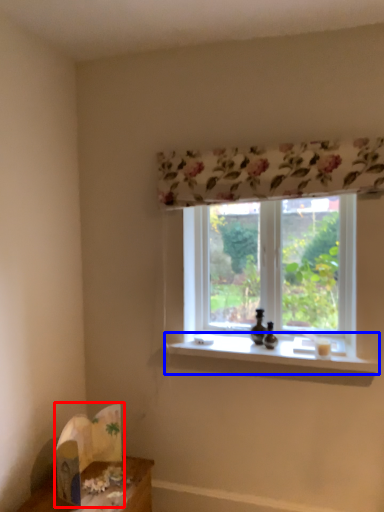
Question: Among these objects, which one is nearest to the camera, cardboard box (highlighted by a red box) or window sill (highlighted by a blue box)?

Choices:
 (A) cardboard box
 (B) window sill

Answer: (A)